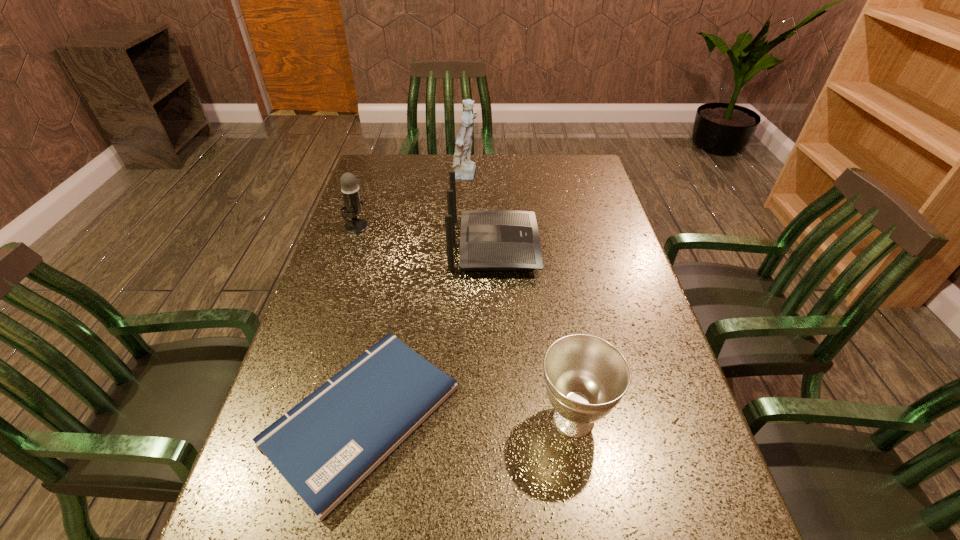
The image size is (960, 540). Find the location of `the farthest object`. the farthest object is located at coordinates (464, 169).

Locate an element on the screen. The height and width of the screenshot is (540, 960). figurine is located at coordinates (464, 169).

Identify the location of router. (490, 240).

Find the location of a particular element. This screenshot has width=960, height=540. microphone is located at coordinates (350, 190).

Find the location of `chalice`. chalice is located at coordinates (586, 377).

At what (x,y) coordinates should I click in order to perform the action: click on paperback book. Please return your answer as a coordinate pair (x, y). The height and width of the screenshot is (540, 960). Looking at the image, I should click on (325, 446).

In order to click on vacant space located on the front-facing side of the figurine in this screenshot , I will do tap(512, 177).

Identify the location of free location located on the front-facing side of the router. (596, 246).

You are a GUI agent. You are given a task and a screenshot of the screen. Output one action in this format:
    pyautogui.click(x=<x>, y=<y>)
    Task: Click on the free region located on the right of the microphone
    
    Given the screenshot: What is the action you would take?
    pyautogui.click(x=489, y=226)

Locate an element on the screen. The image size is (960, 540). vacant space located 0.170m on the left of the chalice is located at coordinates (450, 419).